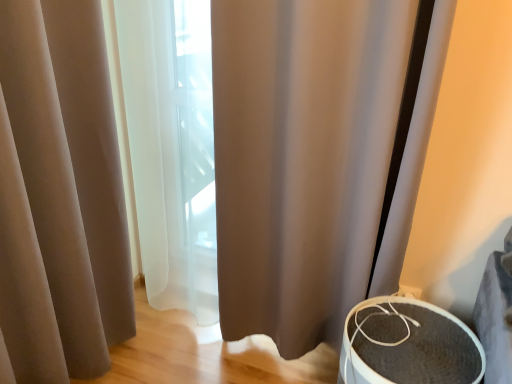
This screenshot has width=512, height=384. What do you see at coordinates (60, 195) in the screenshot?
I see `matte beige curtain at left` at bounding box center [60, 195].

This screenshot has width=512, height=384. What are the coordinates of `brown fabric shower curtain at center` in the screenshot? It's located at (302, 158).

The height and width of the screenshot is (384, 512). What are the coordinates of `shower curtain on the right side of matte beige curtain at left` in the screenshot? It's located at (302, 158).

Between point (17, 179) and point (247, 159), which one is positioned in front?

Point (17, 179)

Is matte beige curtain at left aimed at brown fabric shower curtain at center?

No, matte beige curtain at left is not aimed at brown fabric shower curtain at center.

In the scene shown: Does matte beige curtain at left appear on the right side of brown fabric shower curtain at center?

In fact, matte beige curtain at left is to the left of brown fabric shower curtain at center.

Considering the points (67, 365) and (416, 327), which point is behind, point (67, 365) or point (416, 327)?

The point (67, 365) is behind.

Is matte beige curtain at left taller than textured gray speaker at lower right?

Correct, matte beige curtain at left is much taller as textured gray speaker at lower right.

Can you see matte beige curtain at left touching textured gray speaker at lower right?

matte beige curtain at left and textured gray speaker at lower right are clearly separated.

Considering their positions, is matte beige curtain at left located in front of or behind textured gray speaker at lower right?

matte beige curtain at left is in front of textured gray speaker at lower right.

From the image's perspective, which is above, textured gray speaker at lower right or matte beige curtain at left?

matte beige curtain at left, from the image's perspective.

Find the location of `round table that appears below the matte beige curtain at left (from the image's perspective)`. round table that appears below the matte beige curtain at left (from the image's perspective) is located at coordinates (408, 345).

How far apart are brown fabric shower curtain at center and textured gray speaker at lower right?

The distance of brown fabric shower curtain at center from textured gray speaker at lower right is 15.42 inches.

Which of these two, brown fabric shower curtain at center or textured gray speaker at lower right, stands taller?

brown fabric shower curtain at center.

How different are the orientations of brown fabric shower curtain at center and textured gray speaker at lower right in degrees?

There is a 1.41-degree angle between the facing directions of brown fabric shower curtain at center and textured gray speaker at lower right.

Can we say brown fabric shower curtain at center lies outside textured gray speaker at lower right?

Indeed, brown fabric shower curtain at center is completely outside textured gray speaker at lower right.

In terms of width, does textured gray speaker at lower right look wider or thinner when compared to brown fabric shower curtain at center?

textured gray speaker at lower right is wider than brown fabric shower curtain at center.

Which is farther, [461,378] or [239,40]?

The point [239,40] is more distant.

In the scene shown: What's the angular difference between textured gray speaker at lower right and brown fabric shower curtain at center's facing directions?

textured gray speaker at lower right and brown fabric shower curtain at center are facing 1.41 degrees away from each other.

From a real-world perspective, between brown fabric shower curtain at center and matte beige curtain at left, who is vertically higher?

brown fabric shower curtain at center.

Is brown fabric shower curtain at center located outside matte beige curtain at left?

brown fabric shower curtain at center lies outside matte beige curtain at left's area.

You are a GUI agent. You are given a task and a screenshot of the screen. Output one action in this format:
    pyautogui.click(x=<x>, y=<y>)
    Task: Click on the curtain beneath the brown fabric shower curtain at center (from a real-world perspective)
    This screenshot has height=384, width=512.
    Given the screenshot: What is the action you would take?
    (x=60, y=195)

Locate an element on the screen. shower curtain above the matte beige curtain at left (from the image's perspective) is located at coordinates (302, 158).

This screenshot has height=384, width=512. Identify the location of round table below the matte beige curtain at left (from the image's perspective). (408, 345).

Looking at this image, which object lies nearer to the anchor point matte beige curtain at left, brown fabric shower curtain at center or textured gray speaker at lower right?

brown fabric shower curtain at center is closer to matte beige curtain at left.

When comparing their distances from matte beige curtain at left, does textured gray speaker at lower right or brown fabric shower curtain at center seem closer?

Among the two, brown fabric shower curtain at center is located nearer to matte beige curtain at left.

Looking at the image, which one is located further to brown fabric shower curtain at center, textured gray speaker at lower right or matte beige curtain at left?

Among the two, matte beige curtain at left is located further to brown fabric shower curtain at center.

Consider the image. Looking at the image, which one is located closer to brown fabric shower curtain at center, matte beige curtain at left or textured gray speaker at lower right?

textured gray speaker at lower right.

Looking at the image, which one is located further to textured gray speaker at lower right, matte beige curtain at left or brown fabric shower curtain at center?

Based on the image, matte beige curtain at left appears to be further to textured gray speaker at lower right.

Looking at the image, which one is located closer to textured gray speaker at lower right, brown fabric shower curtain at center or matte beige curtain at left?

Among the two, brown fabric shower curtain at center is located nearer to textured gray speaker at lower right.

Locate an element on the screen. The image size is (512, 384). shower curtain between matte beige curtain at left and textured gray speaker at lower right from left to right is located at coordinates (302, 158).